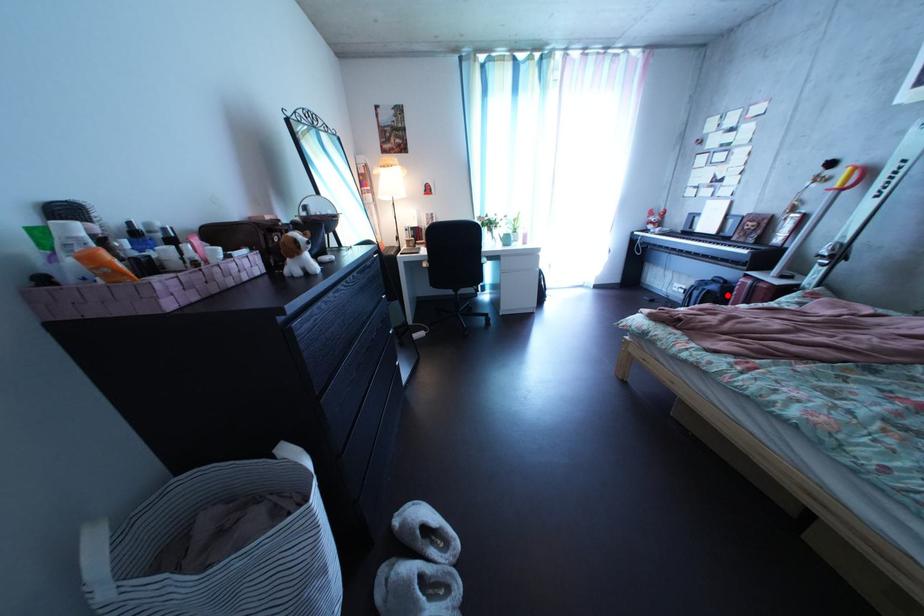
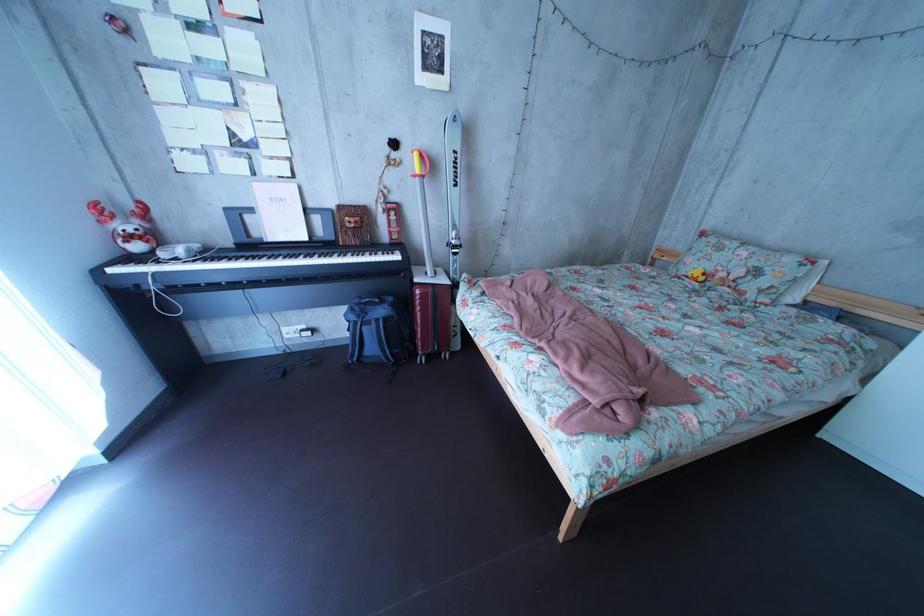
Question: I am providing you with two images of the same scene from different viewpoints. A red point is marked on the first image. Can you still see the location of the red point in image 2?

Choices:
 (A) Yes
 (B) No

Answer: (A)